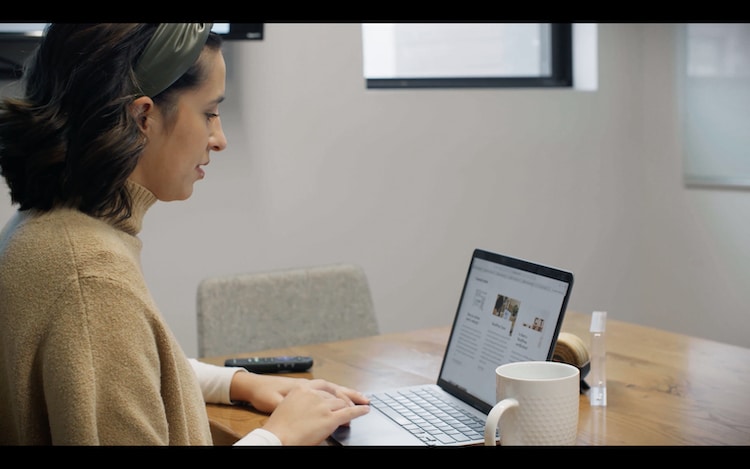
Find the location of a particular element. table is located at coordinates (682, 357).